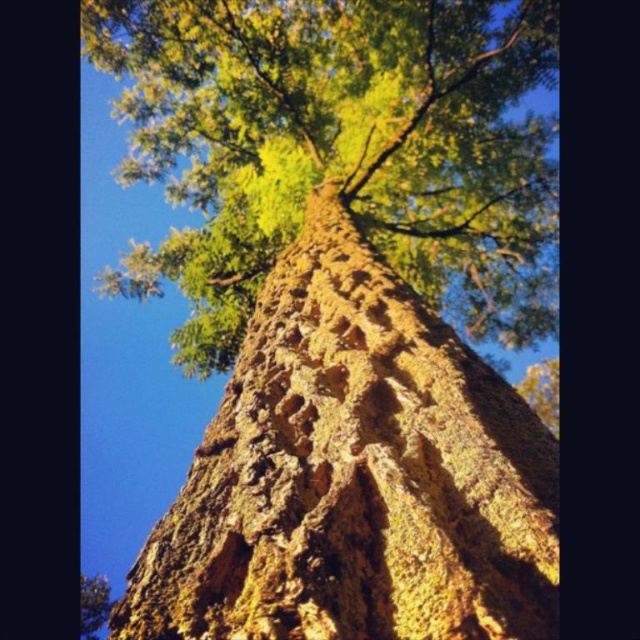
Who is more distant from viewer, (390, 380) or (291, 8)?

Positioned behind is point (291, 8).

From the picture: Is green mossy bark at center further to the viewer compared to rough textured bark at center?

No, it is not.

Between point (426, 380) and point (456, 307), which one is positioned in front?

Point (426, 380) is in front.

This screenshot has height=640, width=640. I want to click on green mossy bark at center, so click(355, 474).